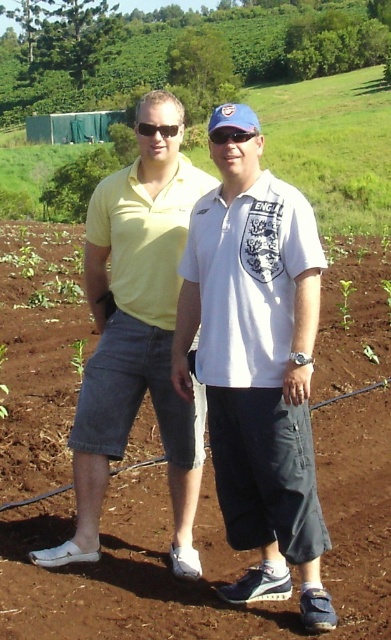
You are a photographer trying to capture a closeup of the white cotton shirt at center and the sunglasses at center. Since you want to focus on the shirt first, which object should you adjust your camera to focus on first based on their positions?

The white cotton shirt at center has a greater height compared to sunglasses at center, so you should focus on the white cotton shirt at center first as it is taller and likely closer to the camera.

You are a photographer trying to capture a closeup of the white cotton shirt at center and the sunglasses at center. Since you want both items in focus, you need to know their relative positions. Which object is positioned to the left?

The white cotton shirt at center is to the left of sunglasses at center, so the white cotton shirt at center is positioned to the left.

You are a photographer trying to capture a closeup of the white cotton shirt at center and sunglasses at center. Which object should you zoom in more on to ensure both are in focus?

The white cotton shirt at center has a larger size compared to sunglasses at center, so you should zoom in more on the sunglasses at center to ensure both are in focus.